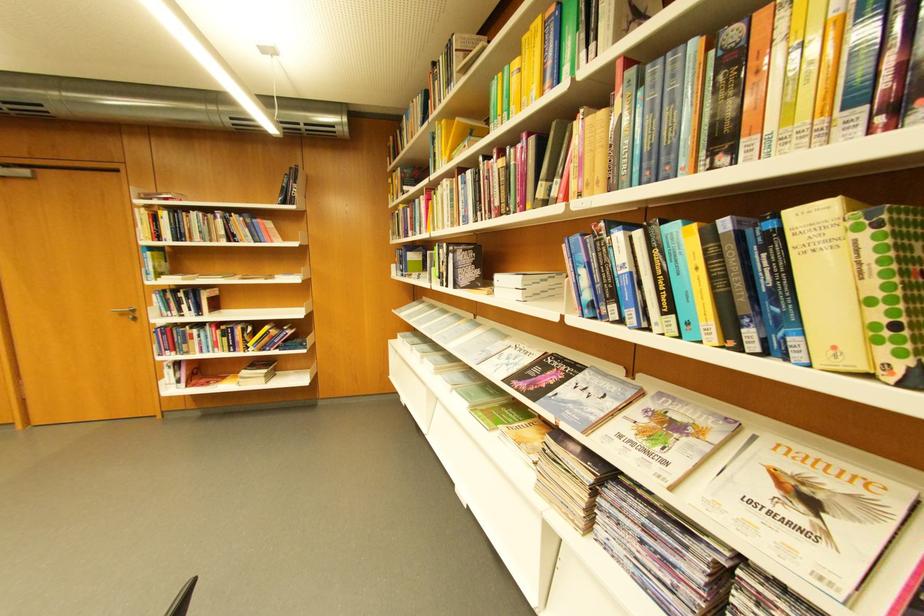
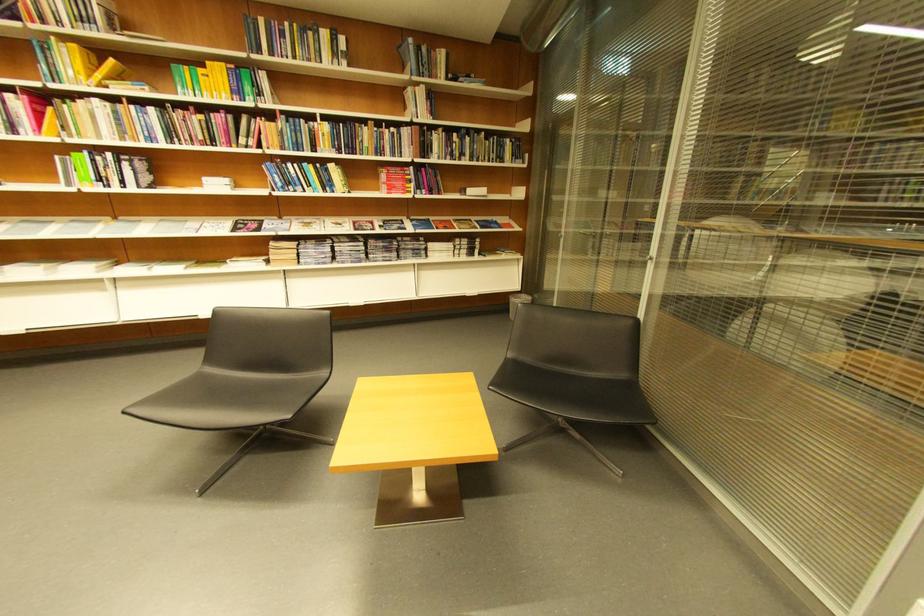
Find the pixel in the second image that matches point (456, 183) in the first image.

(106, 102)